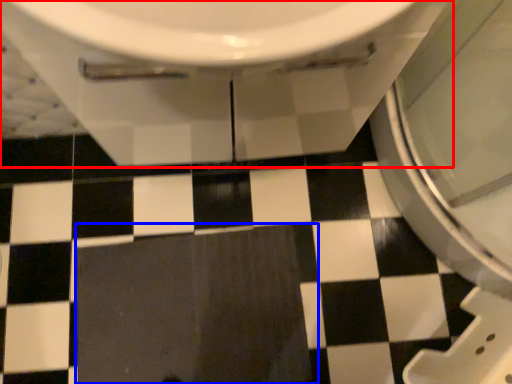
Question: Which point is closer to the camera, toilet (highlighted by a red box) or ceramic tile (highlighted by a blue box)?

Choices:
 (A) toilet
 (B) ceramic tile

Answer: (A)